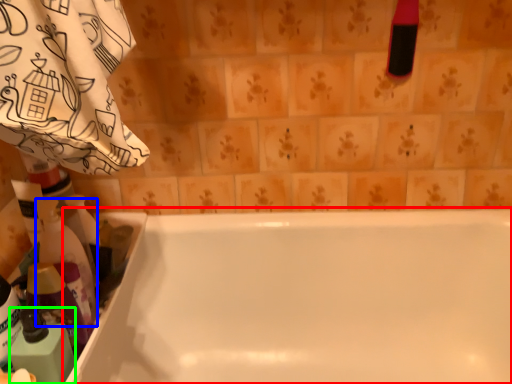
Question: Estimate the real-world distances between objects in this image. Which object is closer to bathtub (highlighted by a red box), cleaning product (highlighted by a blue box) or cleaning product (highlighted by a green box)?

Choices:
 (A) cleaning product
 (B) cleaning product

Answer: (A)